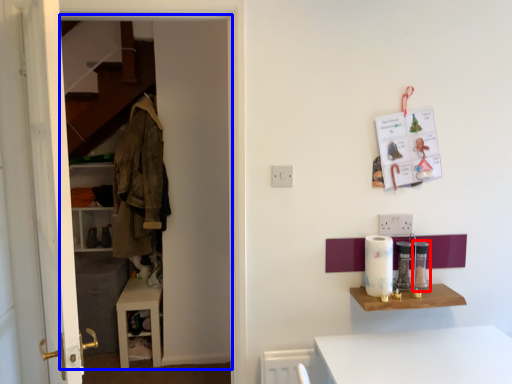
Question: Which object is closer to the camera taking this photo, appliance (highlighted by a red box) or dresser (highlighted by a blue box)?

Choices:
 (A) appliance
 (B) dresser

Answer: (B)